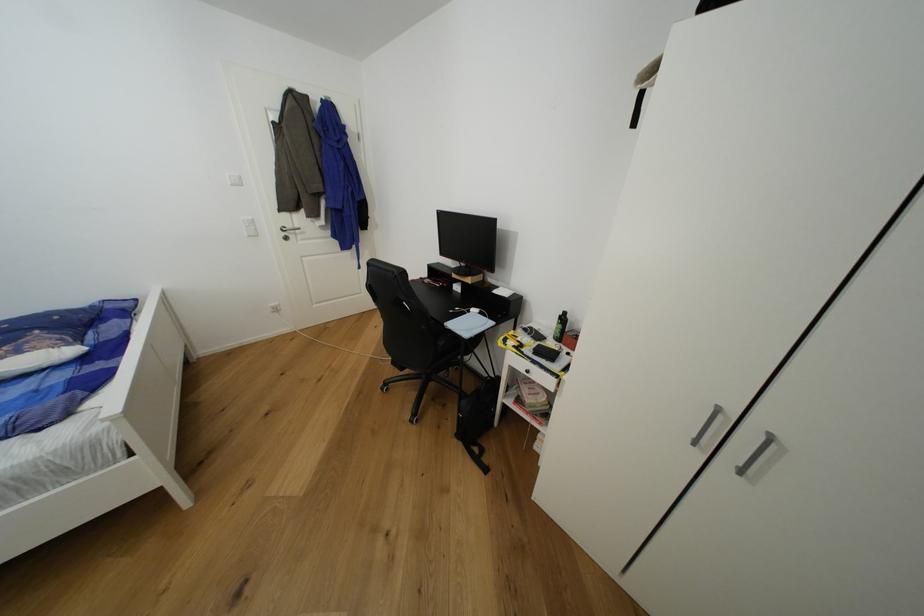
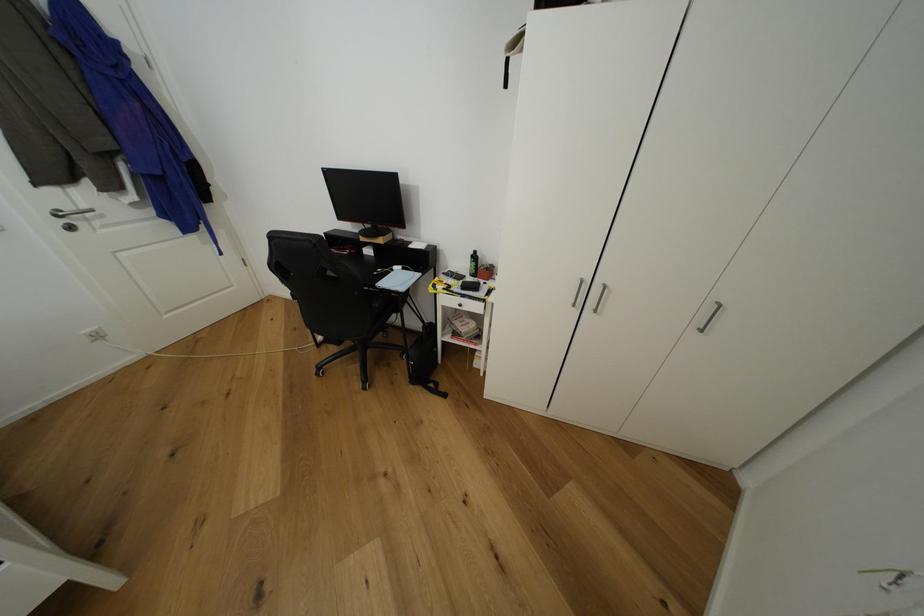
The point at (565, 318) is marked in the first image. Where is the corresponding point in the second image?

(478, 257)